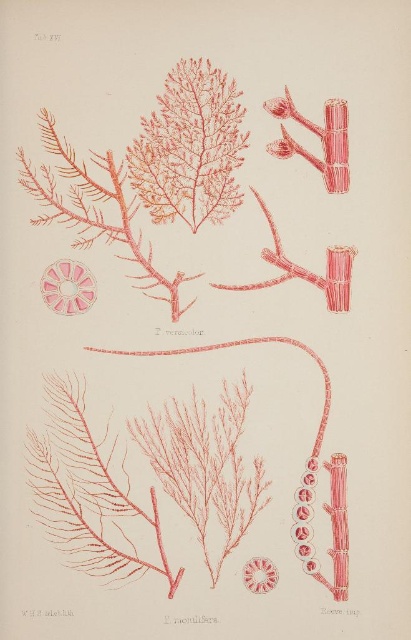
Is point (260, 204) positioned after point (251, 573)?

Yes, it is behind point (251, 573).

The image size is (411, 640). I want to click on smooth pinkish-red branch at upper right, so click(x=304, y=268).

Where is `smooth pinkish-red branch at upper right`? Image resolution: width=411 pixels, height=640 pixels. smooth pinkish-red branch at upper right is located at coordinates (304, 268).

In the scene shown: Measure the distance between matte pink seaweed at upper center and camera.

They are 3.96 feet apart.

Looking at this image, is matte pink seaweed at upper center to the right of translucent pink flower at center from the viewer's perspective?

Yes, matte pink seaweed at upper center is to the right of translucent pink flower at center.

Between point (207, 208) and point (270, 577), which one is positioned behind?

The point (207, 208) is behind.

This screenshot has width=411, height=640. What are the coordinates of `matte pink seaweed at upper center` in the screenshot? It's located at (189, 147).

Who is more distant from viewer, (39, 464) or (133, 216)?

Point (133, 216)

Describe the element at coordinates (85, 492) in the screenshot. I see `matte pink coral at center` at that location.

Measure the distance between matte pink coral at center and camera.

matte pink coral at center and camera are 3.96 feet apart from each other.

Locate an element on the screen. matte pink coral at center is located at coordinates (85, 492).